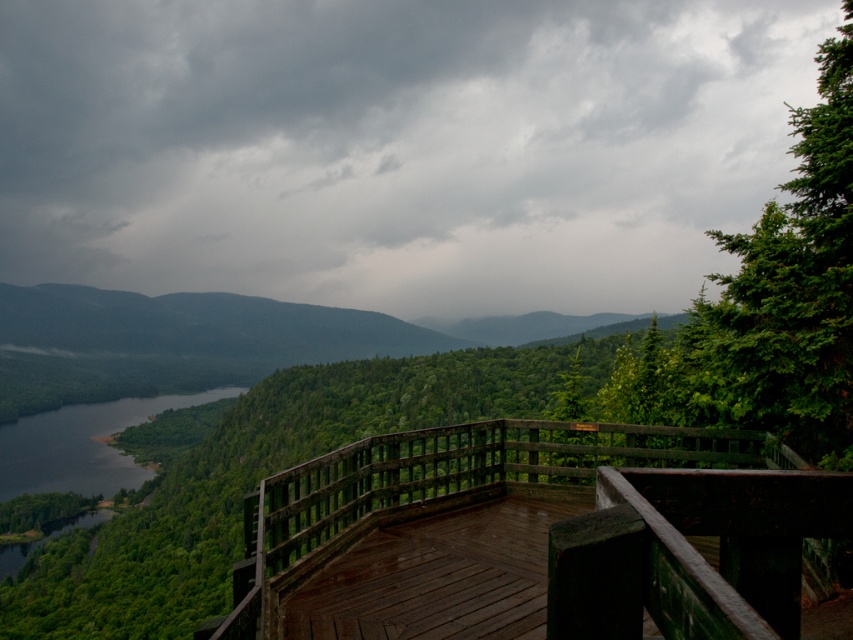
This screenshot has width=853, height=640. What do you see at coordinates (395, 147) in the screenshot? I see `dark gray cloud at upper center` at bounding box center [395, 147].

Is the position of dark gray cloud at upper center less distant than that of wooden deck at center?

No, dark gray cloud at upper center is behind wooden deck at center.

You are a GUI agent. You are given a task and a screenshot of the screen. Output one action in this format:
    pyautogui.click(x=<x>, y=<y>)
    Task: Click on the dark gray cloud at upper center
    The width and height of the screenshot is (853, 640).
    Given the screenshot: What is the action you would take?
    pyautogui.click(x=395, y=147)